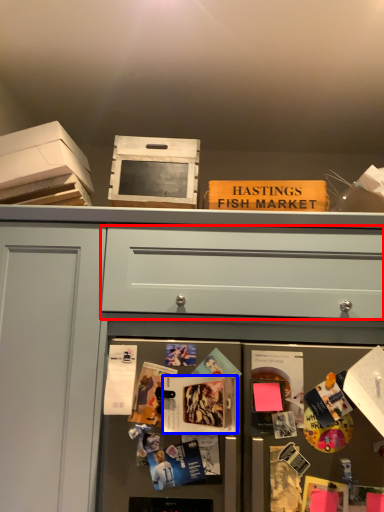
Question: Among these objects, which one is farthest to the camera, drawer (highlighted by a red box) or magazine (highlighted by a blue box)?

Choices:
 (A) drawer
 (B) magazine

Answer: (A)